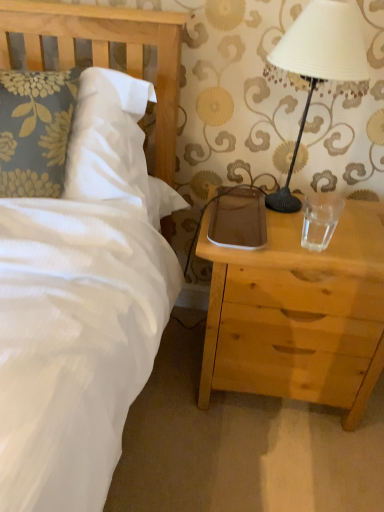
Locate an element on the screen. free spot in front of white matte lampshade at upper right is located at coordinates (311, 245).